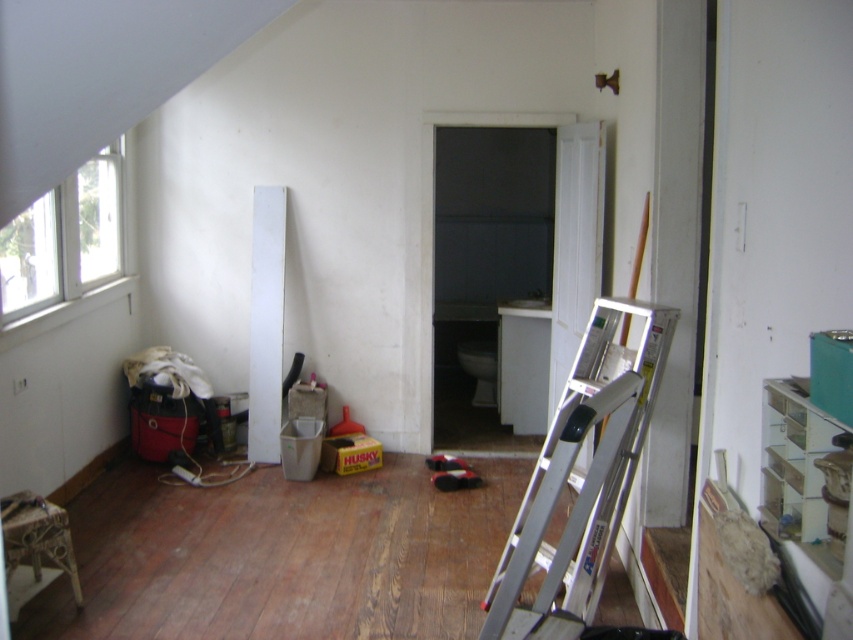
Question: Does silver metallic ladder at lower right appear under white plastic window at upper left?

Choices:
 (A) yes
 (B) no

Answer: (A)

Question: Among these points, which one is nearest to the camera?

Choices:
 (A) (627, 484)
 (B) (16, 314)

Answer: (A)

Question: Is silver metallic ladder at lower right above white plastic window at upper left?

Choices:
 (A) yes
 (B) no

Answer: (B)

Question: Does silver metallic ladder at lower right have a smaller size compared to white plastic window at upper left?

Choices:
 (A) no
 (B) yes

Answer: (A)